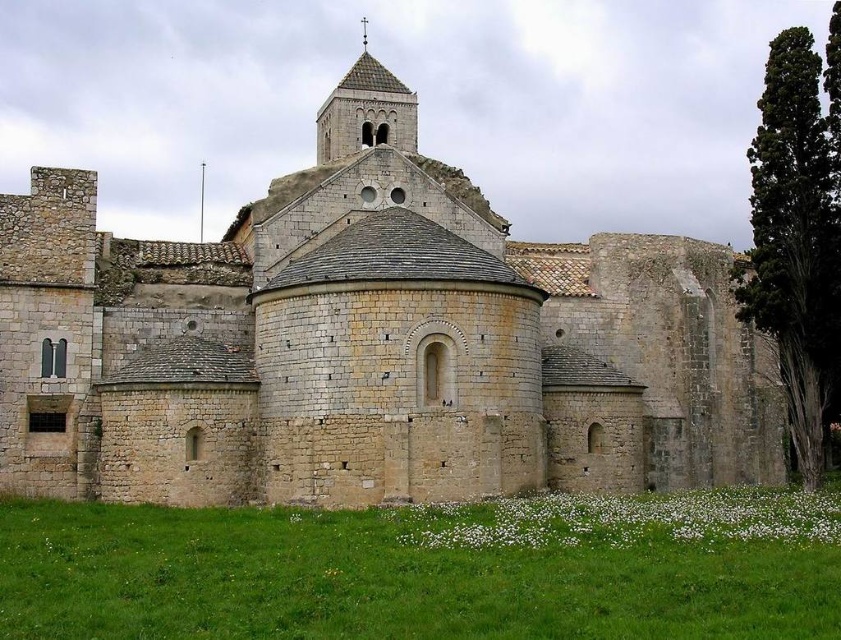
You are a construction worker planning to install a new communication antenna between the stone castle at center and the smooth stone tower at upper center. The antenna requires a minimum distance of 20 meters between its support points. Can the antenna be installed between these two structures based on their current spacing?

The stone castle at center and the smooth stone tower at upper center are 22.57 meters apart, which exceeds the minimum required distance of 20 meters. Therefore, the antenna can be installed between them.

You are standing in front of the historic stone church or monastery. You notice the stone castle at center and the smooth stone tower at upper center. Which object is closer to you?

The stone castle at center is closer to you because it is in front of the smooth stone tower at upper center.

You are an architect examining the historic stone church. You notice the stone castle at center and the smooth stone tower at upper center. Which of these two structures is smaller in size?

The stone castle at center has a smaller size compared to the smooth stone tower at upper center, so the stone castle at center is the smaller one.